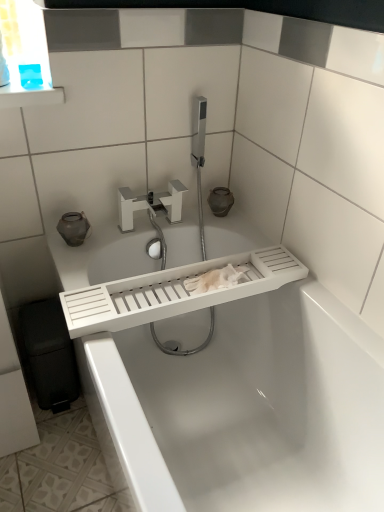
Question: Visually, is white plastic bathtub at center positioned to the left or to the right of white matte faucet at center?

Choices:
 (A) left
 (B) right

Answer: (B)

Question: Does point (188, 472) appear closer or farther from the camera than point (180, 202)?

Choices:
 (A) farther
 (B) closer

Answer: (B)

Question: Is white plastic bathtub at center inside or outside of white matte faucet at center?

Choices:
 (A) outside
 (B) inside

Answer: (A)

Question: From a real-world perspective, is white matte faucet at center physically located above or below white plastic bathtub at center?

Choices:
 (A) above
 (B) below

Answer: (A)

Question: Is white matte faucet at center bigger or smaller than white plastic bathtub at center?

Choices:
 (A) big
 (B) small

Answer: (B)

Question: Is white matte faucet at center in front of or behind white plastic bathtub at center in the image?

Choices:
 (A) front
 (B) behind

Answer: (B)

Question: In terms of height, does white matte faucet at center look taller or shorter compared to white plastic bathtub at center?

Choices:
 (A) short
 (B) tall

Answer: (A)